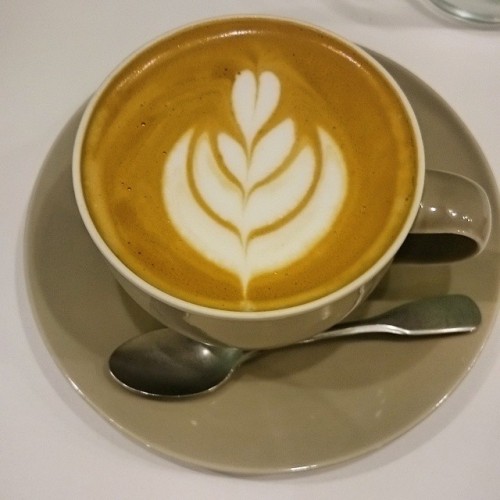
Identify the location of metal spoon. This screenshot has height=500, width=500. (205, 371), (458, 323).